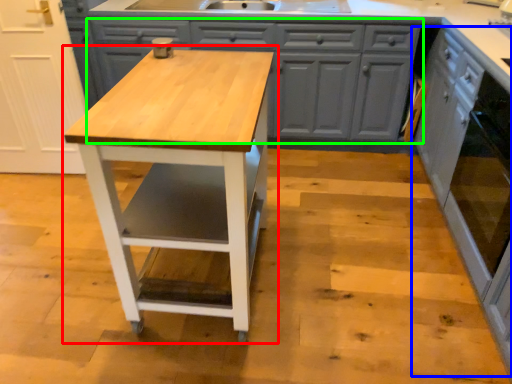
Question: Estimate the real-world distances between objects in this image. Which object is closer to table (highlighted by a red box), cabinetry (highlighted by a blue box) or cabinetry (highlighted by a green box)?

Choices:
 (A) cabinetry
 (B) cabinetry

Answer: (B)